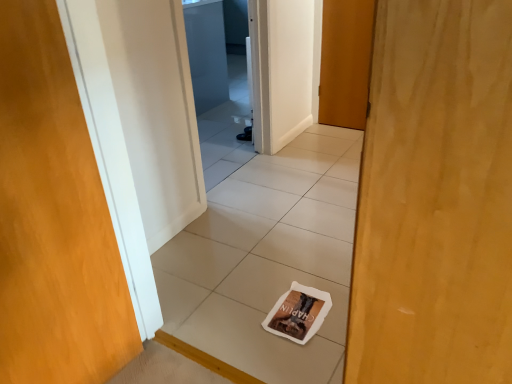
Identify the location of vacant space that is to the left of brown paper magazine at center. The image size is (512, 384). (240, 310).